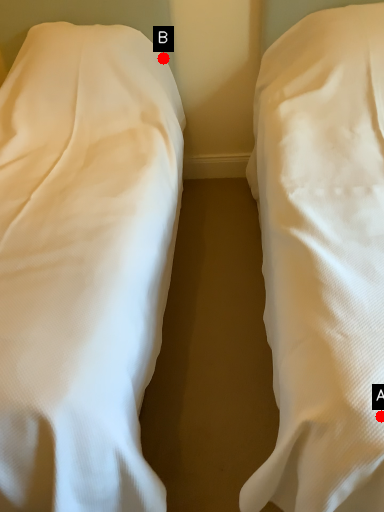
Question: Two points are circled on the image, labeled by A and B beside each circle. Which of the following is the farthest from the observer?

Choices:
 (A) A is further
 (B) B is further

Answer: (B)